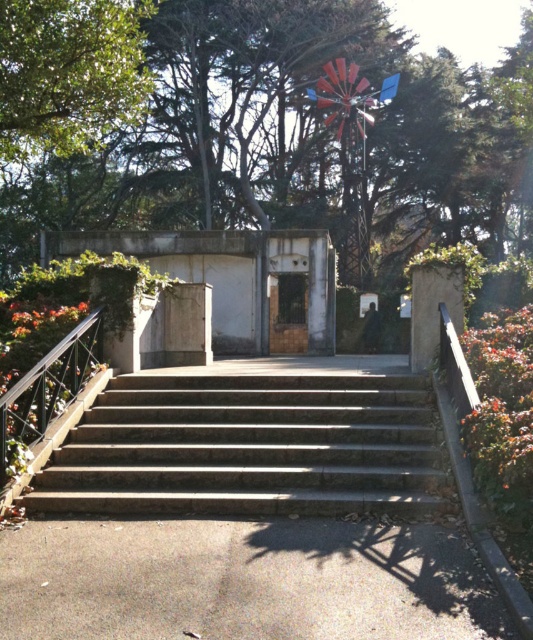
Does slate stone stairs at center have a greater height compared to wooden door at center?

No, slate stone stairs at center is not taller than wooden door at center.

Can you confirm if slate stone stairs at center is positioned to the left of wooden door at center?

Yes, slate stone stairs at center is to the left of wooden door at center.

Between point (127, 404) and point (284, 340), which one is positioned behind?

Positioned behind is point (284, 340).

In order to click on slate stone stairs at center in this screenshot , I will do `click(249, 449)`.